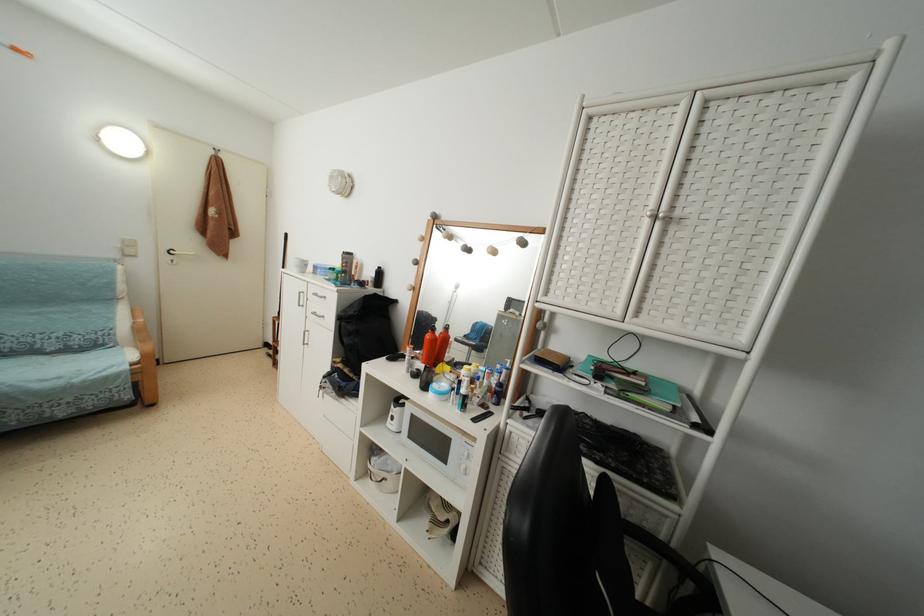
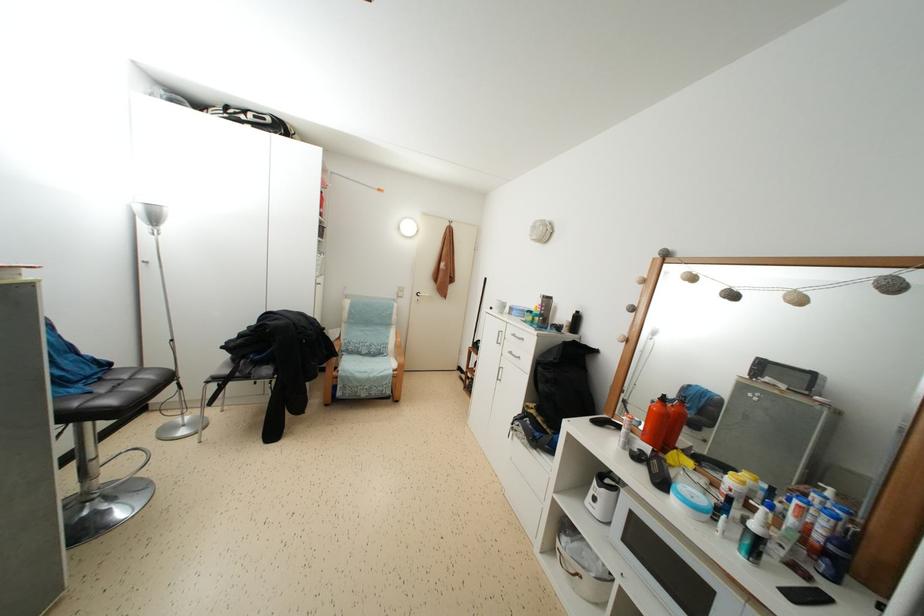
Locate, in the second image, the point that corresponds to [117,367] in the first image.

(390, 371)